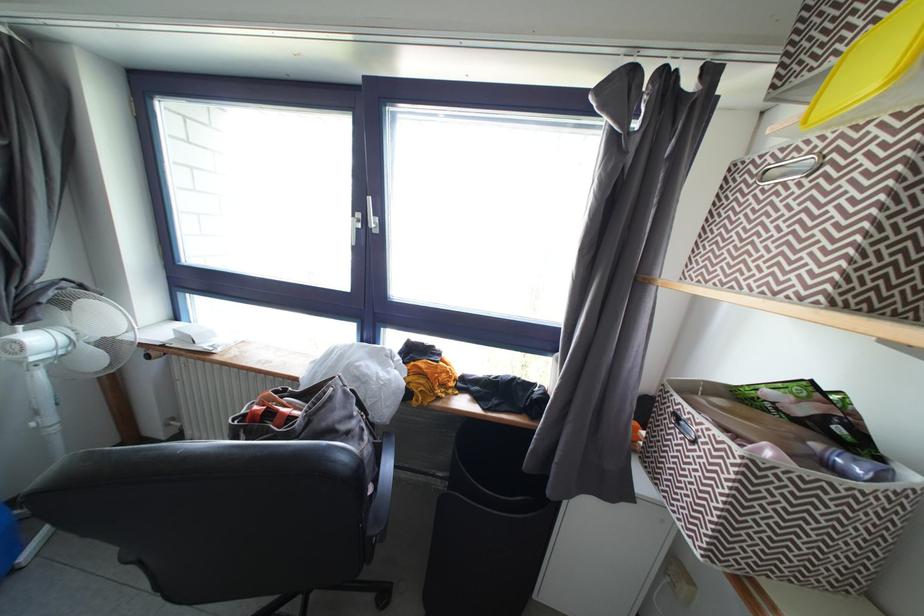
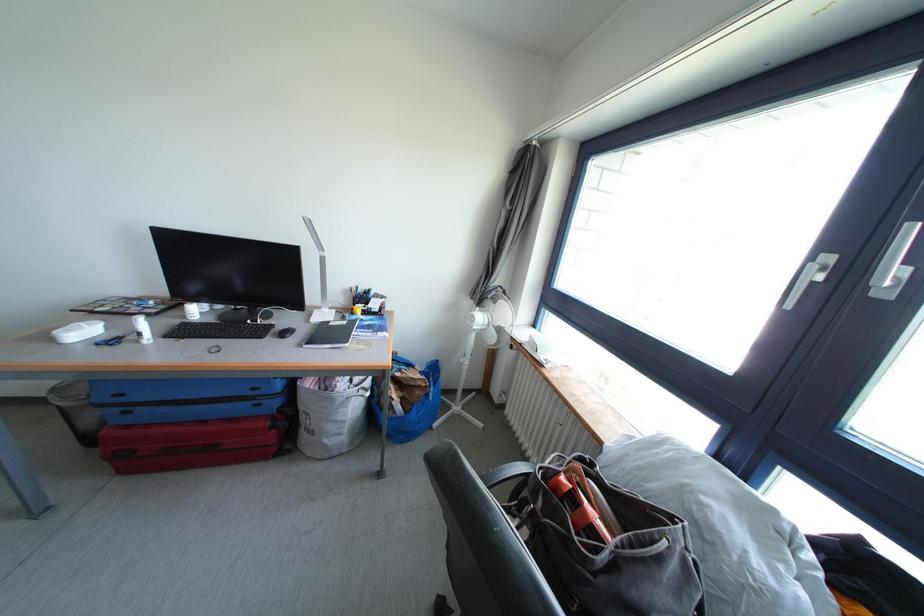
Where in the second image is the point corresponding to point (359, 220) from the first image?

(819, 262)